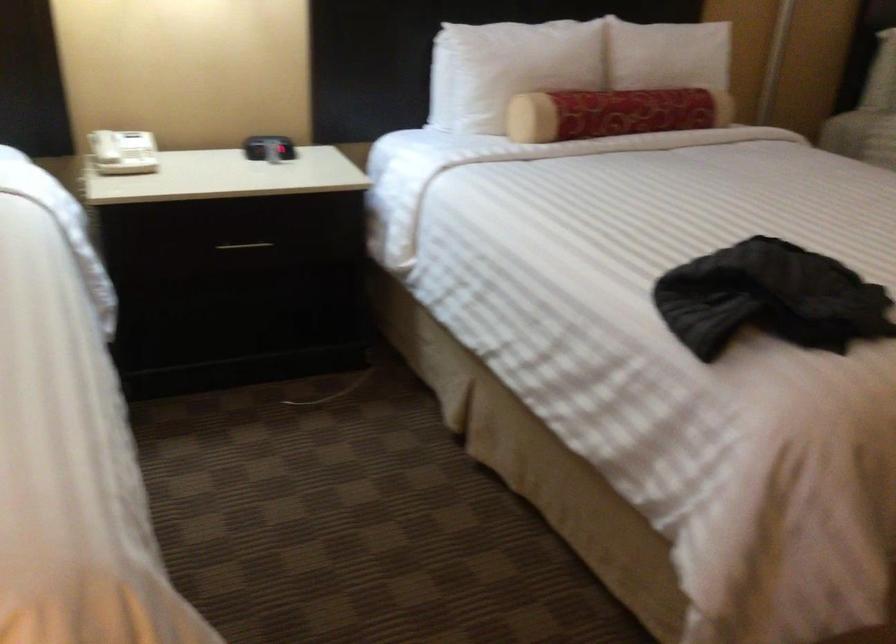
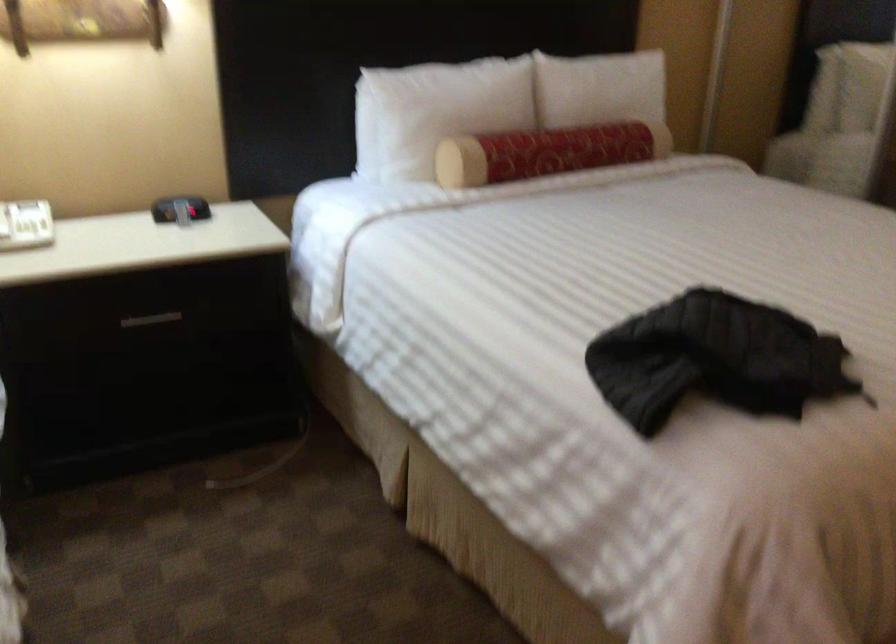
Find the pixel in the second image that matches pixel 240 245 in the first image.

(151, 319)